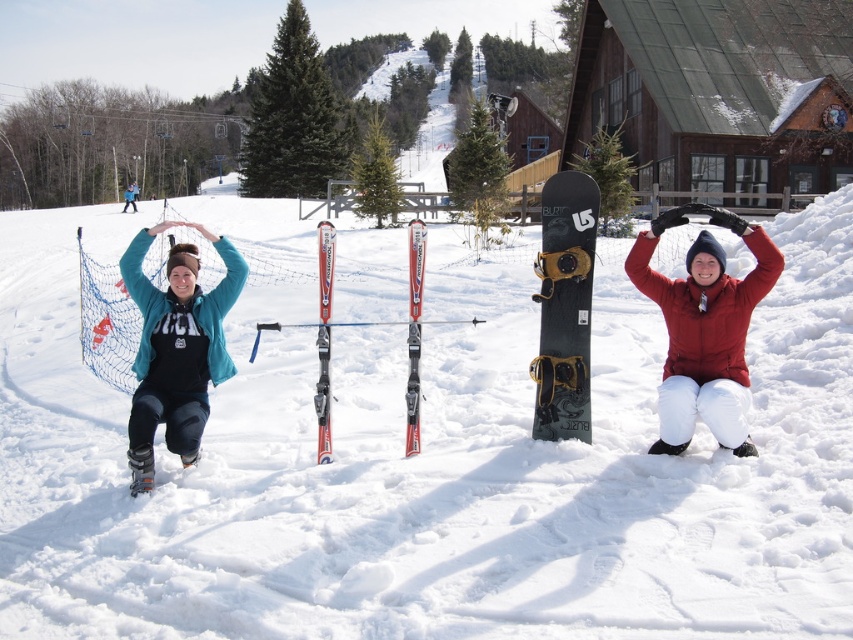
You are planning to place a 1.5 meter long banner between the black matte snowboard at center and the shiny red skis at center. Will the banner fit without overlapping either object?

The distance between the black matte snowboard at center and the shiny red skis at center is 1.38 meters. Since the banner is 1.5 meters long, it will not fit without overlapping the objects.

You are a photographer trying to capture a photo of the brushed metal ski boots at lower left and the red metallic skis at center. If you want to ensure both objects are in focus, which object should you focus on first to account for their sizes?

Since the brushed metal ski boots at lower left is larger in size compared to the red metallic skis at center, you should focus on the brushed metal ski boots at lower left first to ensure both are in focus.

You are planning to carry both the black matte snowboard at center and the shiny red skis at center. Which one will be harder to carry because of its size?

The black matte snowboard at center is bigger than the shiny red skis at center, so it will be harder to carry due to its larger size.